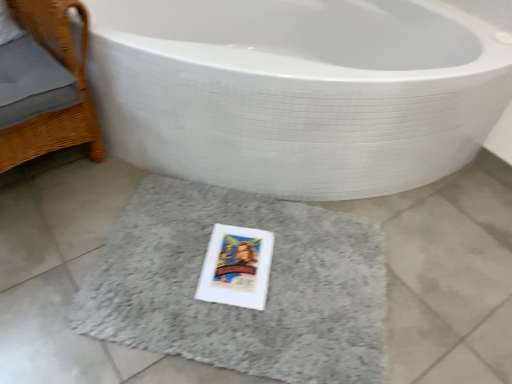
Question: Would you say white glossy bathtub at center is outside woven wood chair at left?

Choices:
 (A) yes
 (B) no

Answer: (A)

Question: Could you tell me if white glossy bathtub at center is facing woven wood chair at left?

Choices:
 (A) yes
 (B) no

Answer: (B)

Question: From the image's perspective, is white glossy bathtub at center above woven wood chair at left?

Choices:
 (A) no
 (B) yes

Answer: (B)

Question: Is white glossy bathtub at center at the left side of woven wood chair at left?

Choices:
 (A) no
 (B) yes

Answer: (A)

Question: From a real-world perspective, is white glossy bathtub at center under woven wood chair at left?

Choices:
 (A) yes
 (B) no

Answer: (A)

Question: Is white glossy bathtub at center further to the viewer compared to woven wood chair at left?

Choices:
 (A) no
 (B) yes

Answer: (A)

Question: Considering the relative sizes of gray shaggy bath mat at center and woven wood chair at left in the image provided, is gray shaggy bath mat at center wider than woven wood chair at left?

Choices:
 (A) no
 (B) yes

Answer: (B)

Question: Can you confirm if gray shaggy bath mat at center is positioned to the left of woven wood chair at left?

Choices:
 (A) no
 (B) yes

Answer: (A)

Question: Can we say gray shaggy bath mat at center lies outside woven wood chair at left?

Choices:
 (A) yes
 (B) no

Answer: (A)

Question: Is the surface of gray shaggy bath mat at center in direct contact with woven wood chair at left?

Choices:
 (A) no
 (B) yes

Answer: (A)

Question: Is gray shaggy bath mat at center in front of woven wood chair at left?

Choices:
 (A) no
 (B) yes

Answer: (A)

Question: From the image's perspective, is gray shaggy bath mat at center under woven wood chair at left?

Choices:
 (A) no
 (B) yes

Answer: (B)

Question: Is woven wood chair at left located outside gray shaggy bath mat at center?

Choices:
 (A) yes
 (B) no

Answer: (A)